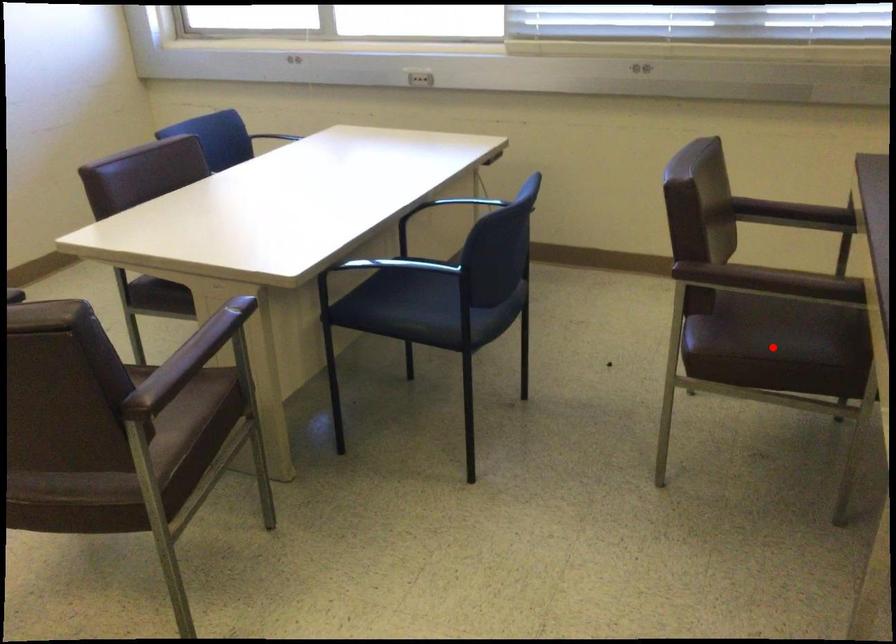
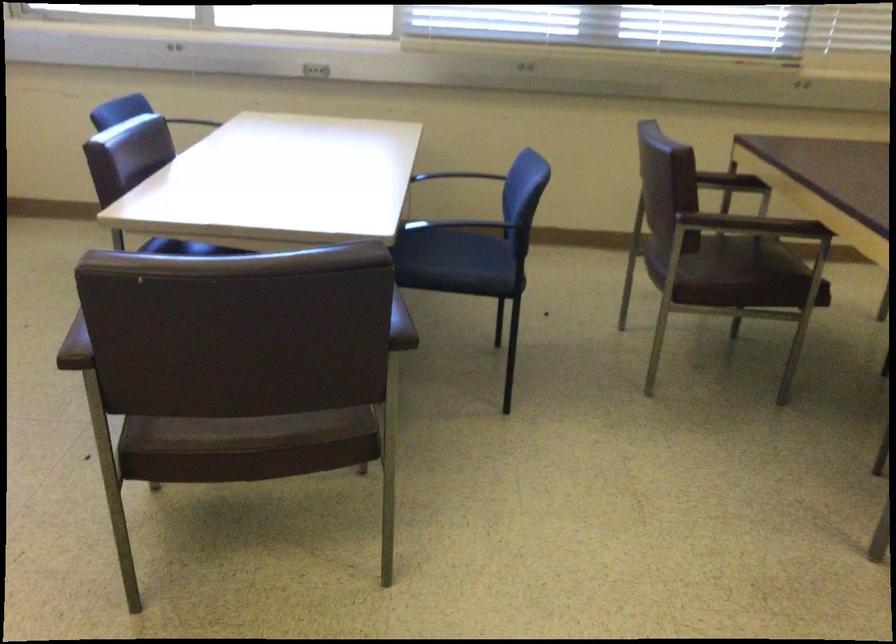
The point at the highlighted location is marked in the first image. Where is the corresponding point in the second image?

(739, 278)